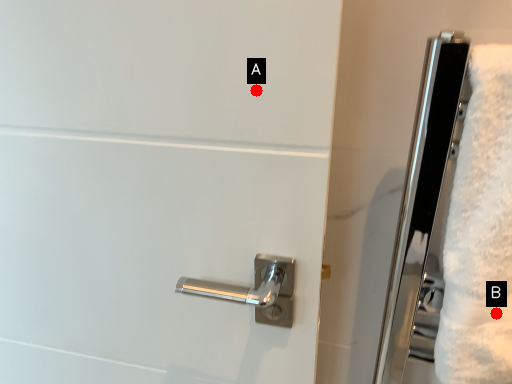
Question: Two points are circled on the image, labeled by A and B beside each circle. Which of the following is the closest to the observer?

Choices:
 (A) A is closer
 (B) B is closer

Answer: (A)